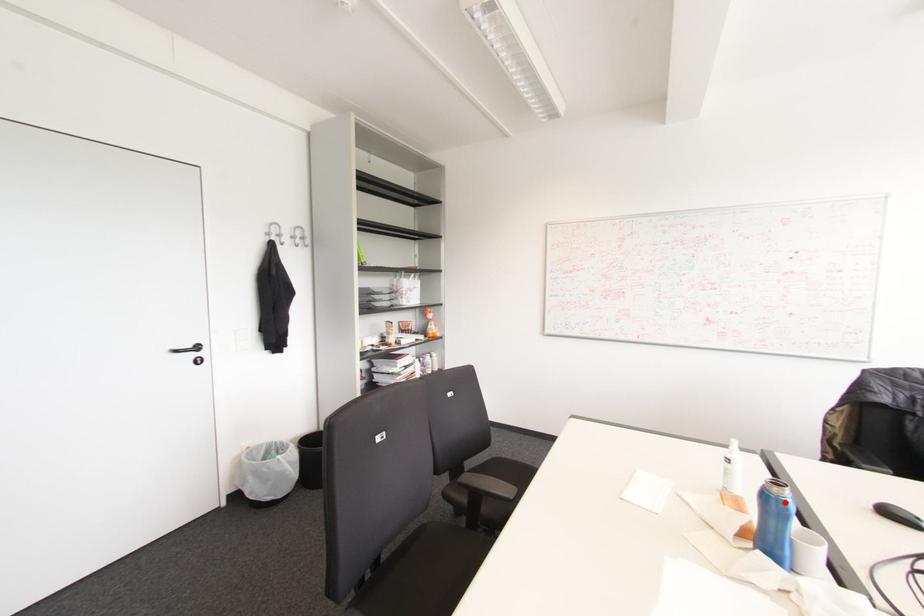
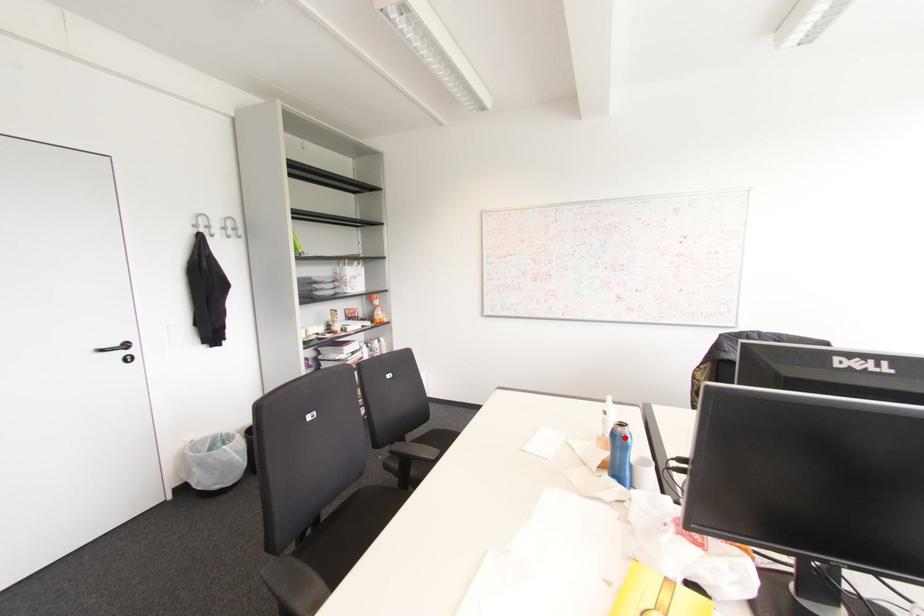
Looking at this image, I am providing you with two images of the same scene from different viewpoints. A red point is marked on the first image and another point is marked on the second image. Are the points marked in image1 and image2 representing the same 3D position?

Yes